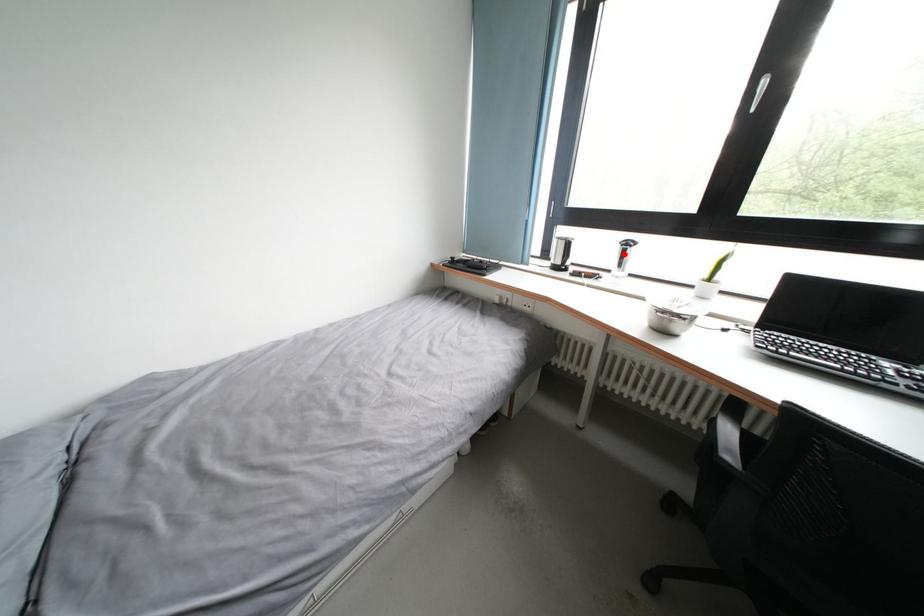
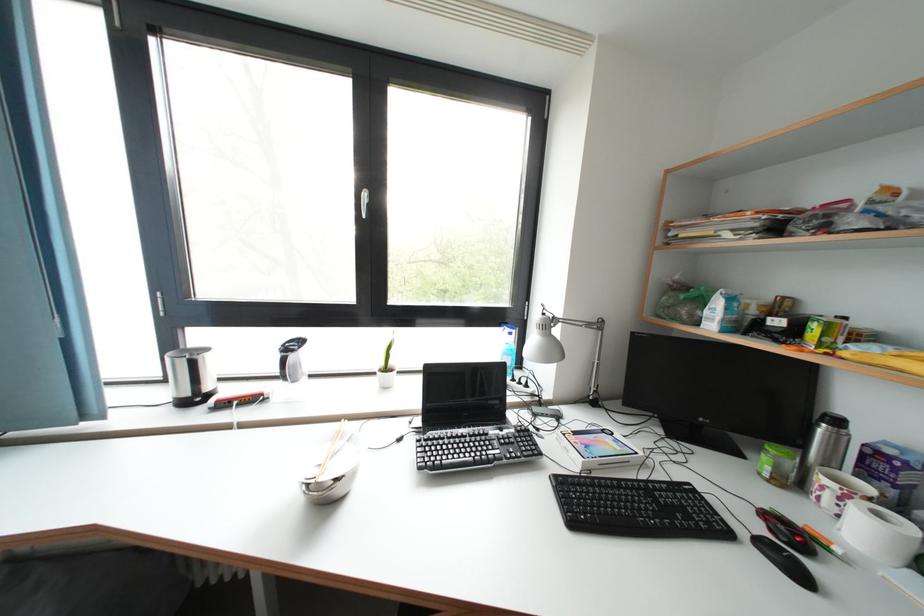
Question: I am providing you with two images of the same scene from different viewpoints. A red point is marked on the first image. Is the red point's position out of view in image 2?

Choices:
 (A) Yes
 (B) No

Answer: (B)